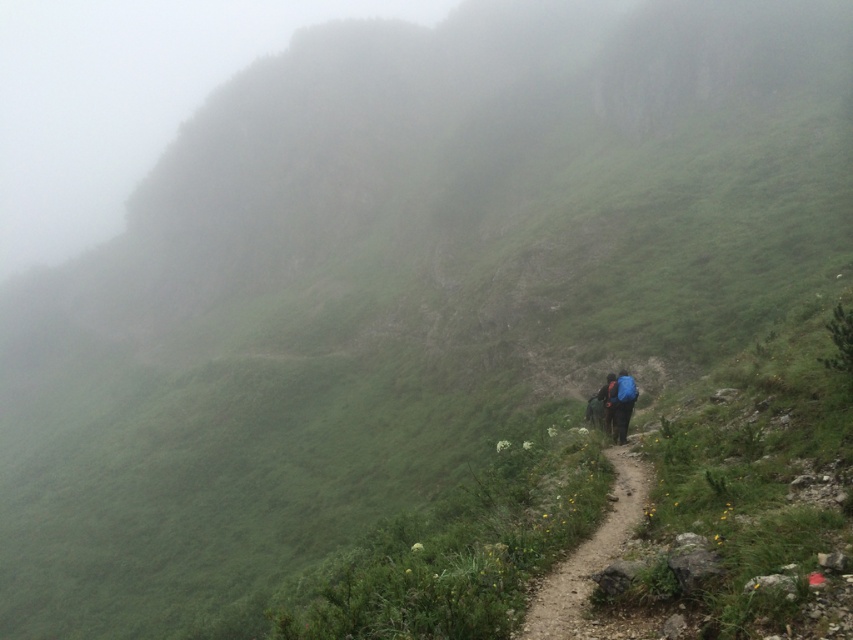
You are a hiker trying to navigate through the misty mountains. You have two backpacks, the blue fabric backpack at lower center and the orange fabric backpack at center. Which backpack is closer to you as you look at the scene?

The blue fabric backpack at lower center is closer to you because it is in front of the orange fabric backpack at center.